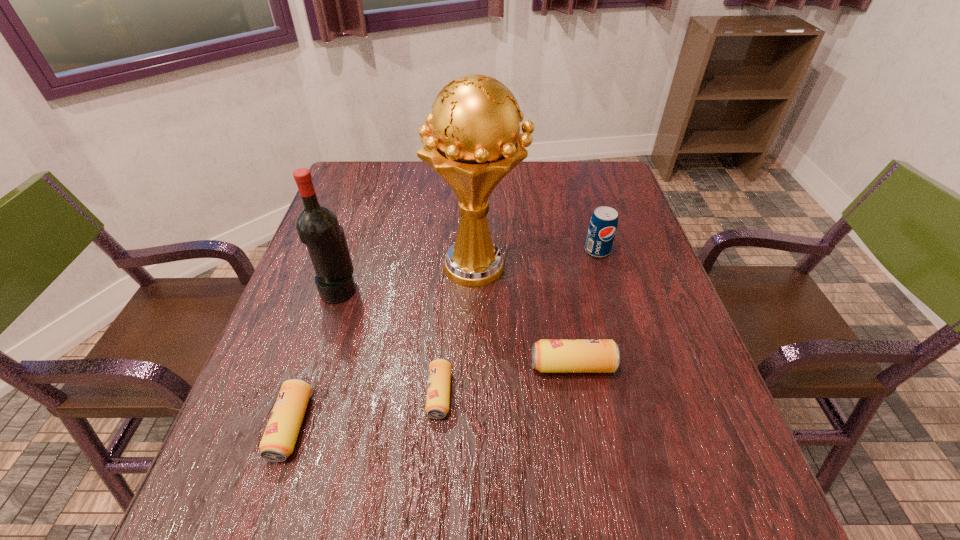
Where is `free space between the second tallest object and the shortest object`? The height and width of the screenshot is (540, 960). free space between the second tallest object and the shortest object is located at coordinates (389, 341).

This screenshot has height=540, width=960. What are the coordinates of `empty space between the fifth shortest object and the second tallest beer can` in the screenshot? It's located at (315, 357).

Identify which object is the second closest to the third tallest object. Please provide its 2D coordinates. Your answer should be formatted as a tuple, i.e. [(x, y)], where the tuple contains the x and y coordinates of a point satisfying the conditions above.

[(548, 355)]

The image size is (960, 540). Identify the location of object that ranks as the third closest to the shortest object. click(x=278, y=441).

Locate which beer can ranks in proximity to the shortest beer can. Please provide its 2D coordinates. Your answer should be formatted as a tuple, i.e. [(x, y)], where the tuple contains the x and y coordinates of a point satisfying the conditions above.

[(548, 355)]

Find the location of a particular element. The image size is (960, 540). beer can that can be found as the second closest to the trophy_cup is located at coordinates (438, 390).

You are a GUI agent. You are given a task and a screenshot of the screen. Output one action in this format:
    pyautogui.click(x=<x>, y=<y>)
    Task: Click on the vacant space that satisfies the following two spatial constraints: 1. at the front of the third shortest object where the globe is prominent; 2. on the right side of the tallest object
    This screenshot has height=540, width=960.
    Given the screenshot: What is the action you would take?
    pyautogui.click(x=476, y=366)

Image resolution: width=960 pixels, height=540 pixels. Find the location of `vacant area that satisfies the following two spatial constraints: 1. at the front of the trophy_cup where the globe is prominent; 2. on the left side of the fourth tallest object`. vacant area that satisfies the following two spatial constraints: 1. at the front of the trophy_cup where the globe is prominent; 2. on the left side of the fourth tallest object is located at coordinates (476, 366).

The width and height of the screenshot is (960, 540). What are the coordinates of `free space in the image that satisfies the following two spatial constraints: 1. on the back side of the tallest beer can; 2. at the front of the trophy_cup where the globe is prominent` in the screenshot? It's located at coord(554,265).

I want to click on vacant space that satisfies the following two spatial constraints: 1. at the front of the trophy_cup where the globe is prominent; 2. on the left side of the rightmost beer can, so click(x=476, y=366).